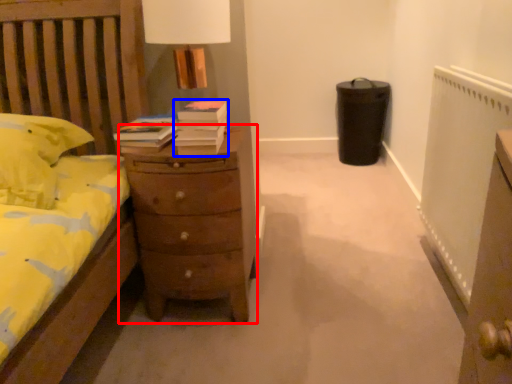
Question: Which of the following is the farthest to the observer, chest of drawers (highlighted by a red box) or book (highlighted by a blue box)?

Choices:
 (A) chest of drawers
 (B) book

Answer: (A)